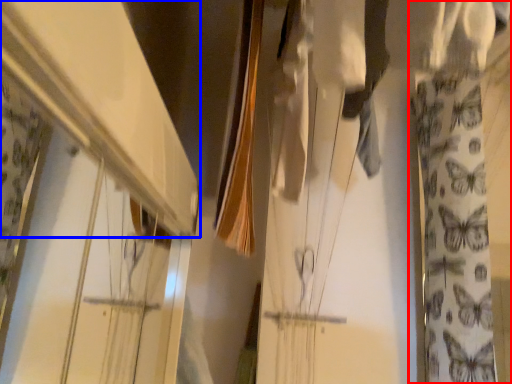
Question: Which object appears farthest to the camera in this image, curtain (highlighted by a red box) or shelf (highlighted by a blue box)?

Choices:
 (A) curtain
 (B) shelf

Answer: (A)